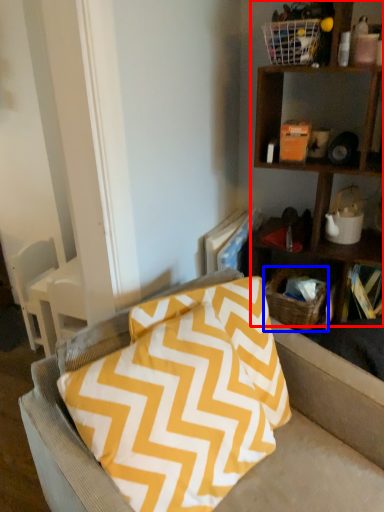
Question: Which object is further to the camera taking this photo, shelf (highlighted by a red box) or basket (highlighted by a blue box)?

Choices:
 (A) shelf
 (B) basket

Answer: (B)